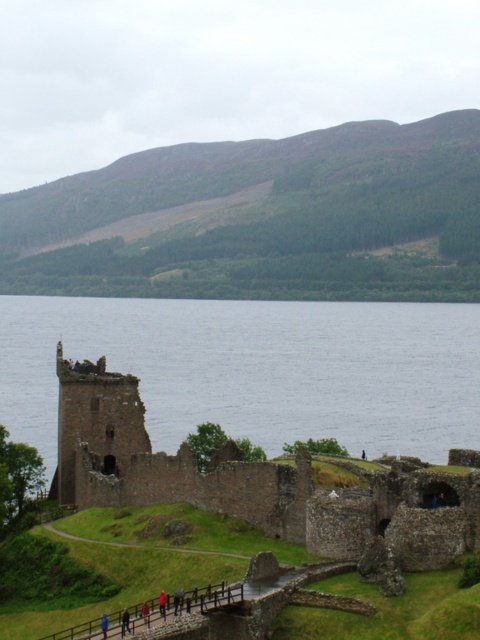
Which of these two, red fabric jacket at center or blue fabric person at lower center, stands taller?

With more height is blue fabric person at lower center.

Can you confirm if red fabric jacket at center is positioned below blue fabric person at lower center?

No.

Measure the distance between point [162,605] and camera.

The distance of point [162,605] from camera is 78.85 meters.

I want to click on red fabric jacket at center, so coord(163,602).

Can you confirm if brown stone castle at left is positioned to the left of red fabric jacket at center?

No, brown stone castle at left is not to the left of red fabric jacket at center.

This screenshot has height=640, width=480. What do you see at coordinates (252, 481) in the screenshot?
I see `brown stone castle at left` at bounding box center [252, 481].

You are a GUI agent. You are given a task and a screenshot of the screen. Output one action in this format:
    pyautogui.click(x=<x>, y=<y>)
    Task: Click on the brown stone castle at left
    The width and height of the screenshot is (480, 640).
    Given the screenshot: What is the action you would take?
    pyautogui.click(x=252, y=481)

Can you confirm if brown stone castle at left is thinner than blue fabric person at lower center?

No, brown stone castle at left is not thinner than blue fabric person at lower center.

Which is above, brown stone castle at left or blue fabric person at lower center?

brown stone castle at left is higher up.

Is point (175, 481) less distant than point (104, 627)?

No, it is not.

Find the location of a particular element. brown stone castle at left is located at coordinates (252, 481).